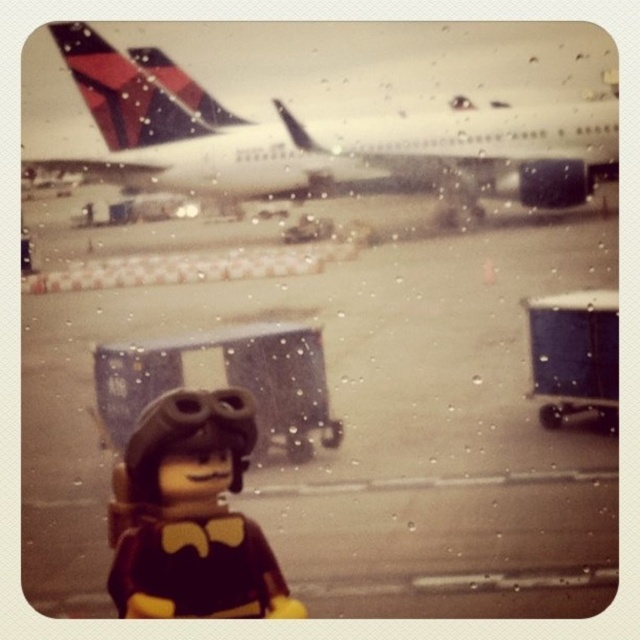
You are a LEGO figure pilot standing on the smooth concrete tarmac at center and looking towards the white matte airplane at upper center. Can you see the airplane through the window?

Yes, the smooth concrete tarmac at center is in front of the white matte airplane at upper center, so the LEGO figure pilot can see the airplane through the window without obstruction.

You are a small LEGO figure wearing aviator goggles and a black outfit with yellow accents. You are standing on the smooth concrete tarmac at center and looking through the window with water droplets. Can you see the white matte airplane at upper center clearly through the window?

The smooth concrete tarmac at center is much taller than the white matte airplane at upper center, so the LEGO figure cannot see the white matte airplane at upper center clearly through the window because the tarmac is blocking the view.